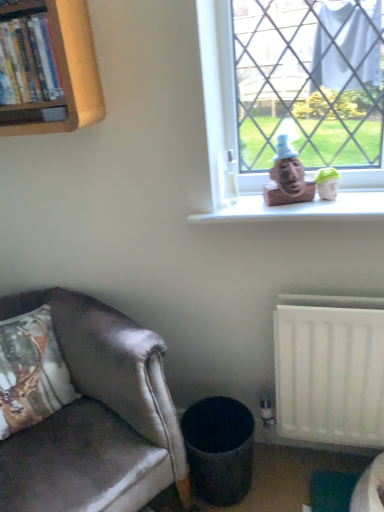
Question: Is matte brown bust at window wider or thinner than green fabric toy at upper right?

Choices:
 (A) thin
 (B) wide

Answer: (B)

Question: Is matte brown bust at window taller or shorter than green fabric toy at upper right?

Choices:
 (A) tall
 (B) short

Answer: (A)

Question: Based on their relative distances, which object is farther from the transparent glass coffee cup at upper center?

Choices:
 (A) textured gray trash can at lower center
 (B) satin brown leather chair at lower left
 (C) matte brown bust at window
 (D) wooden bookshelf at upper left
 (E) green fabric toy at upper right

Answer: (A)

Question: Which is farther from the green fabric toy at upper right?

Choices:
 (A) wooden bookshelf at upper left
 (B) satin brown leather chair at lower left
 (C) transparent glass coffee cup at upper center
 (D) matte brown bust at window
 (E) textured gray trash can at lower center

Answer: (B)